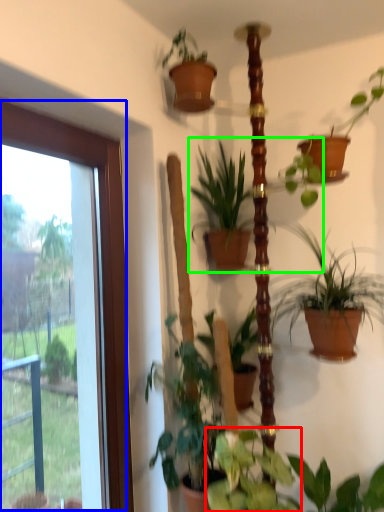
Question: Based on their relative distances, which object is farther from houseplant (highlighted by a red box)? Choose from window (highlighted by a blue box) and houseplant (highlighted by a green box).

Choices:
 (A) window
 (B) houseplant

Answer: (B)